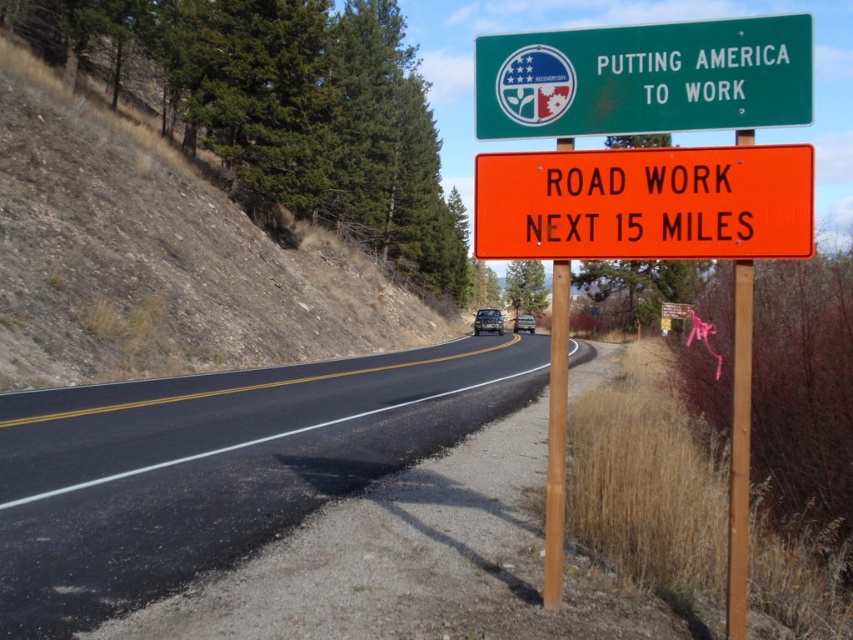
Which of these two, black asphalt road at center or orange reflective plastic sign at right, stands taller?

Standing taller between the two is orange reflective plastic sign at right.

Is point (219, 465) farther from viewer compared to point (704, 228)?

Yes, point (219, 465) is farther from viewer.

Between point (280, 492) and point (572, 180), which one is positioned behind?

The point (280, 492) is more distant.

In order to click on black asphalt road at center in this screenshot , I will do `click(216, 465)`.

Does orange reflective plastic sign at right come behind green metallic sign at upper center?

No, it is not.

Which of these two, orange reflective plastic sign at right or green metallic sign at upper center, stands shorter?

With less height is orange reflective plastic sign at right.

What do you see at coordinates (645, 204) in the screenshot? I see `orange reflective plastic sign at right` at bounding box center [645, 204].

I want to click on orange reflective plastic sign at right, so click(645, 204).

Based on the photo, which of these two, black asphalt road at center or green metallic sign at upper center, stands shorter?

Standing shorter between the two is black asphalt road at center.

Is point (281, 516) farther from camera compared to point (618, 28)?

That is True.

The height and width of the screenshot is (640, 853). I want to click on black asphalt road at center, so click(216, 465).